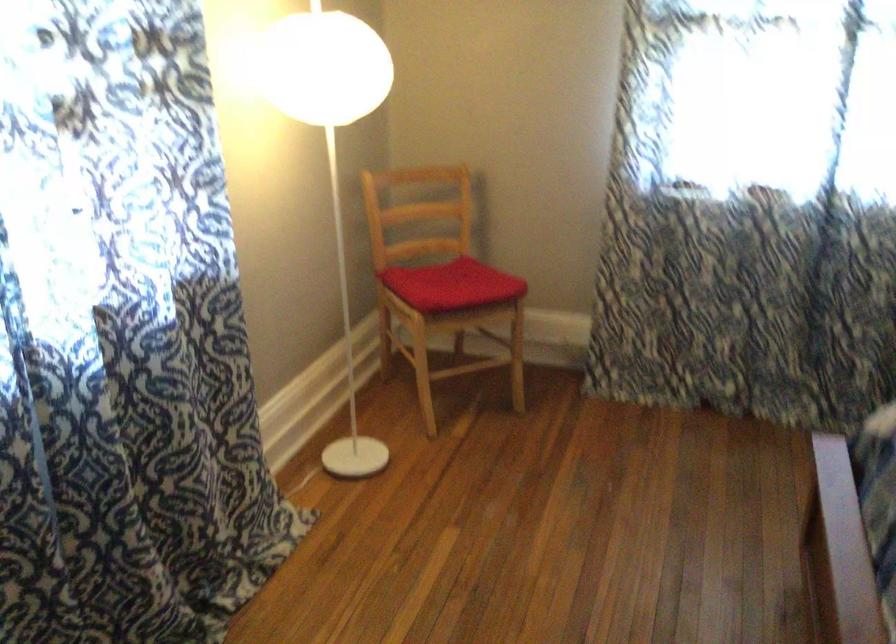
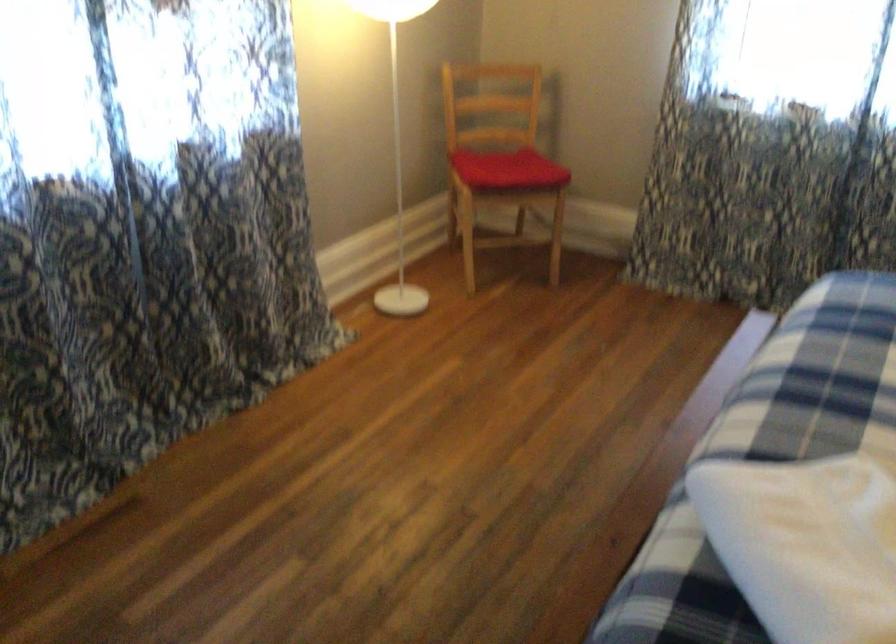
Locate, in the second image, the point that corresponds to pixel 453 290 in the first image.

(507, 169)